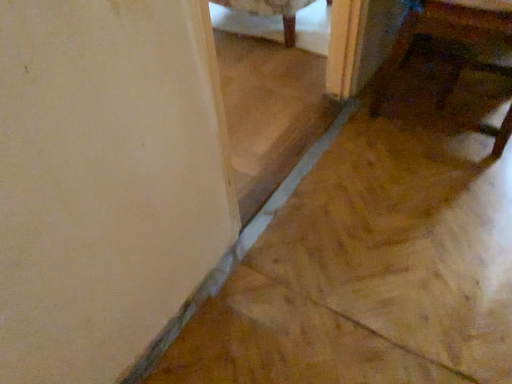
Identify the location of free location in front of wooden table at lower right. This screenshot has width=512, height=384. (436, 185).